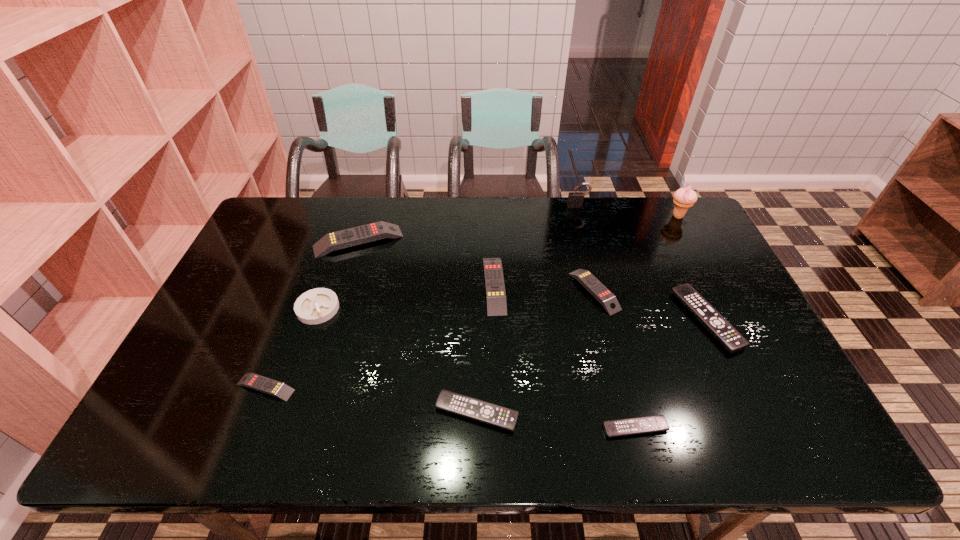
Find the location of `icecream present at the right edge`. icecream present at the right edge is located at coordinates (684, 198).

This screenshot has height=540, width=960. I want to click on remote control situated at the right edge, so click(x=717, y=325).

Image resolution: width=960 pixels, height=540 pixels. In order to click on object located in the far right corner section of the desktop in this screenshot , I will do `click(684, 198)`.

Locate an element on the screen. Image resolution: width=960 pixels, height=540 pixels. free space at the far edge of the desktop is located at coordinates (432, 210).

In the image, there is a desktop. Where is `vacant region at the near edge`? vacant region at the near edge is located at coordinates coord(482,439).

In the image, there is a desktop. Identify the location of vacant space at the left edge. The width and height of the screenshot is (960, 540). (208, 363).

In the image, there is a desktop. At what (x,y) coordinates should I click in order to perform the action: click on vacant space at the right edge. Please return your answer as a coordinate pair (x, y). Image resolution: width=960 pixels, height=540 pixels. Looking at the image, I should click on (710, 343).

The width and height of the screenshot is (960, 540). What are the coordinates of `vacant space at the far left corner` in the screenshot? It's located at (290, 206).

Find the location of a particular element. free space between the tallest object and the smallest black remote control is located at coordinates (657, 322).

Identify the location of unoccupied position between the padlock and the smallest yellow remote control. (421, 296).